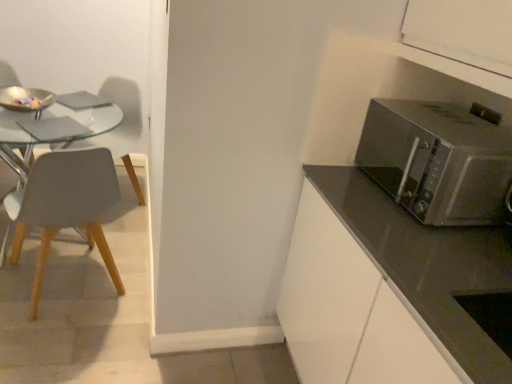
Identify the location of vacant space in front of matte gray chair at left, which appears as the 1th chair when viewed from the front. (49, 343).